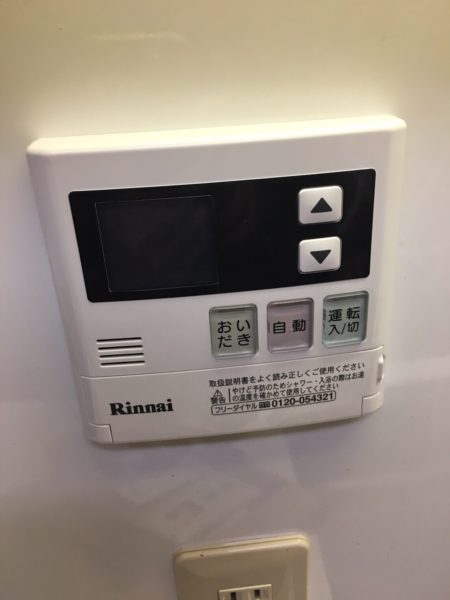
Where is `plate cover`? The width and height of the screenshot is (450, 600). plate cover is located at coordinates (255, 571).